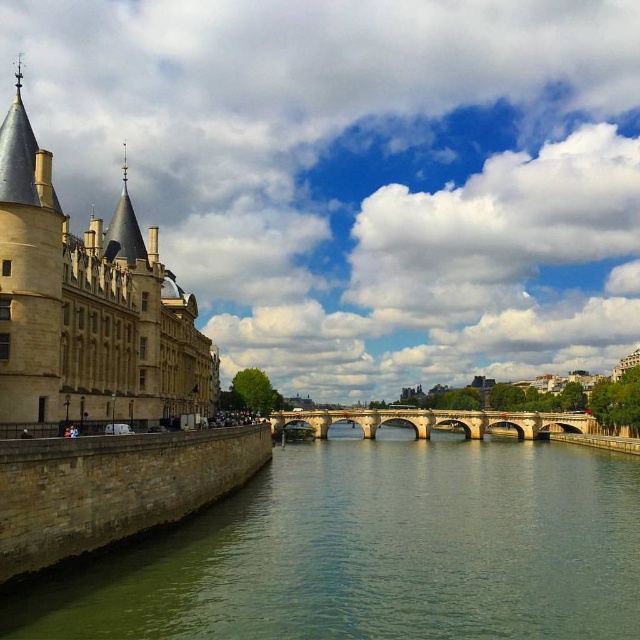
You are a tourist standing on the stone bridge at center, looking towards the green stone river at center. Which object is higher from the ground?

The green stone river at center has a greater height compared to the stone bridge at center, so the green stone river at center is higher from the ground.

You are a tourist standing on the stone embankment near the beige stone castle at left. You want to take a photo of the green stone river at center. Which direction should you face to capture the river in your shot?

You should face to the right to capture the green stone river at center, as it is located to the right of the beige stone castle at left.